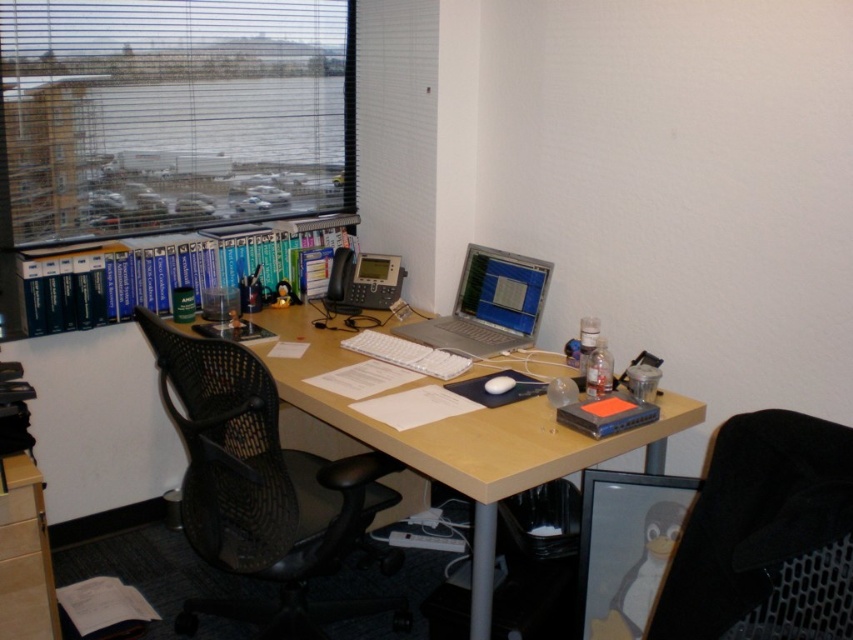
Does transparent plastic blinds at upper left have a greater width compared to black mesh swivel chair at lower right?

Yes.

Measure the distance from transparent plastic blinds at upper left to black mesh swivel chair at lower right.

The distance of transparent plastic blinds at upper left from black mesh swivel chair at lower right is 7.24 feet.

Which is in front, point (242, 74) or point (844, 504)?

Point (844, 504) is in front.

Image resolution: width=853 pixels, height=640 pixels. Identify the location of transparent plastic blinds at upper left. (172, 113).

Is black mesh swivel chair at center thinner than blue hardcover books at upper left?

Indeed, black mesh swivel chair at center has a lesser width compared to blue hardcover books at upper left.

This screenshot has width=853, height=640. I want to click on black mesh swivel chair at center, so click(264, 490).

Identify the location of black mesh swivel chair at center. The image size is (853, 640). (264, 490).

Is point (445, 445) farther from camera compared to point (527, 339)?

No, it is in front of (527, 339).

Describe the element at coordinates (463, 436) in the screenshot. The width and height of the screenshot is (853, 640). I see `wooden desk at center` at that location.

The width and height of the screenshot is (853, 640). What do you see at coordinates (463, 436) in the screenshot?
I see `wooden desk at center` at bounding box center [463, 436].

The width and height of the screenshot is (853, 640). Identify the location of wooden desk at center. (463, 436).